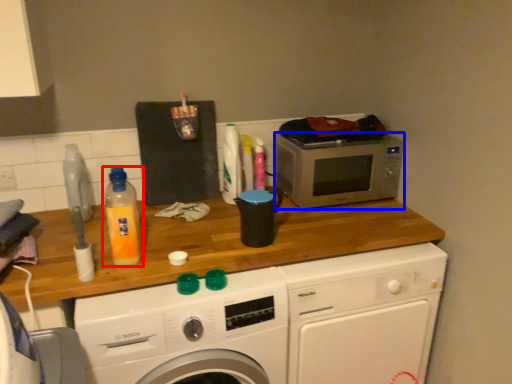
Question: Which object appears closest to the camera in this image, bottle (highlighted by a red box) or microwave oven (highlighted by a blue box)?

Choices:
 (A) bottle
 (B) microwave oven

Answer: (A)